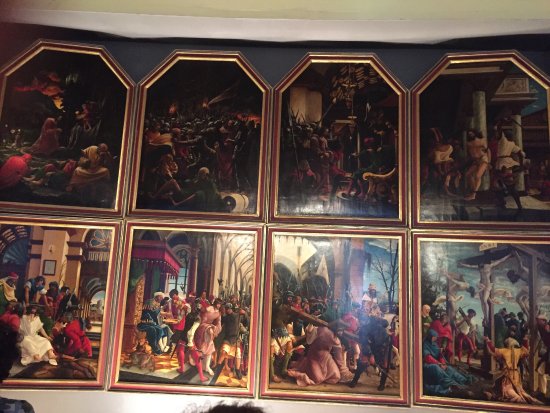
Identify the location of picture. click(x=433, y=391).